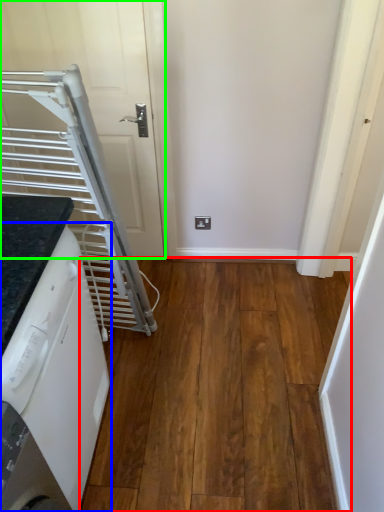
Question: Estimate the real-world distances between objects in this image. Which object is closer to hardwood (highlighted by a red box), home appliance (highlighted by a blue box) or door (highlighted by a green box)?

Choices:
 (A) home appliance
 (B) door

Answer: (A)